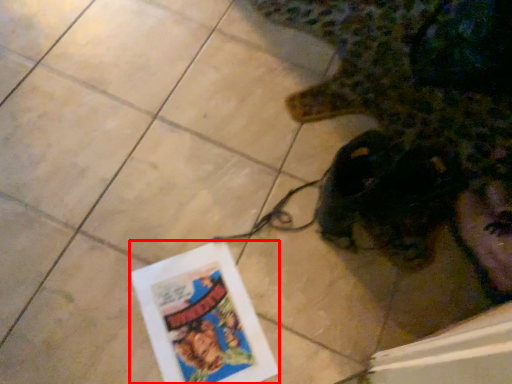
Question: From the image's perspective, where is flyer (annotated by the red box) located in relation to animal in the image?

Choices:
 (A) below
 (B) above

Answer: (A)